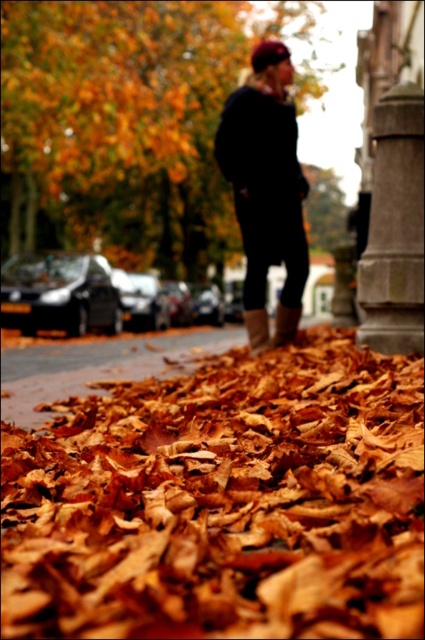
Can you confirm if brown dried leaves at lower center is positioned to the left of leather boot at lower center?

Correct, you'll find brown dried leaves at lower center to the left of leather boot at lower center.

Is brown dried leaves at lower center closer to camera compared to leather boot at lower center?

Yes, brown dried leaves at lower center is closer to the viewer.

Who is more forward, (161, 422) or (297, 314)?

Point (161, 422)

This screenshot has height=640, width=425. What are the coordinates of `brown dried leaves at lower center` in the screenshot? It's located at (223, 500).

Can you confirm if brown suede boot at center is taller than leather boot at lower center?

Yes.

Can you confirm if brown suede boot at center is positioned to the left of leather boot at lower center?

Correct, you'll find brown suede boot at center to the left of leather boot at lower center.

Measure the distance between brown suede boot at center and camera.

They are 6.95 meters apart.

This screenshot has width=425, height=640. Identify the location of brown suede boot at center. (257, 330).

Between brown dried leaves at lower center and gray stone pillar at right, which one appears on the right side from the viewer's perspective?

gray stone pillar at right is more to the right.

Describe the element at coordinates (223, 500) in the screenshot. I see `brown dried leaves at lower center` at that location.

Between point (246, 420) and point (410, 330), which one is positioned behind?

Positioned behind is point (410, 330).

Identify the location of brown dried leaves at lower center. Image resolution: width=425 pixels, height=640 pixels. (223, 500).